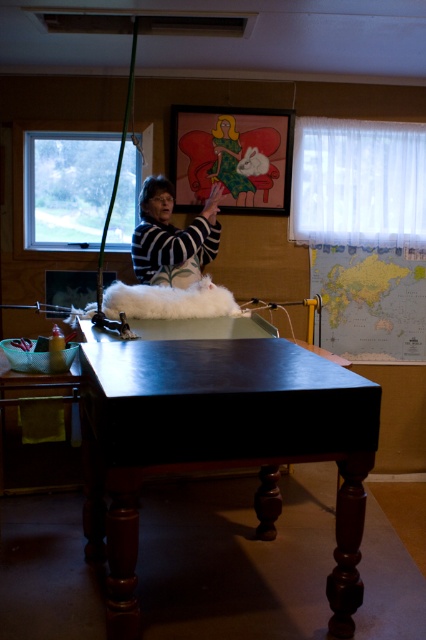
Question: Is shiny dark wood table at center wider than striped sweater at center?

Choices:
 (A) yes
 (B) no

Answer: (A)

Question: Is shiny dark wood table at center bigger than striped sweater at center?

Choices:
 (A) no
 (B) yes

Answer: (B)

Question: Which point is farther to the camera?

Choices:
 (A) shiny dark wood table at center
 (B) striped sweater at center

Answer: (B)

Question: Can you confirm if shiny dark wood table at center is positioned to the left of striped sweater at center?

Choices:
 (A) yes
 (B) no

Answer: (B)